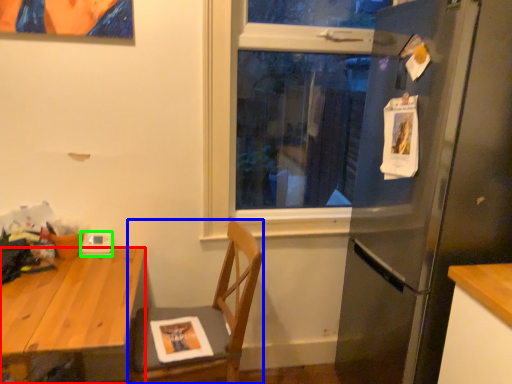
Question: Which object is positioned farthest from desk (highlighted by a red box)? Select from chair (highlighted by a blue box) and appliance (highlighted by a green box).

Choices:
 (A) chair
 (B) appliance

Answer: (A)